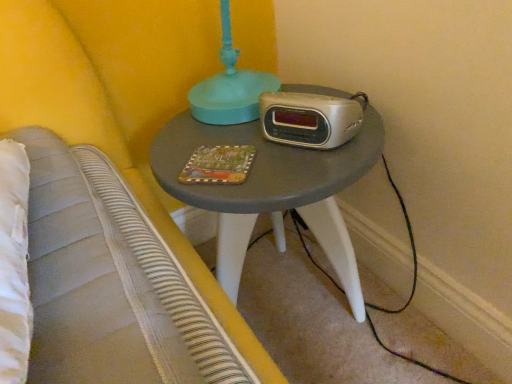
Identify the location of free location in front of silver metallic clock radio at center. (298, 165).